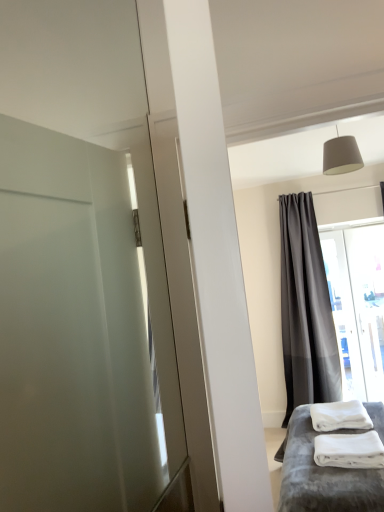
This screenshot has width=384, height=512. Describe the element at coordinates (340, 416) in the screenshot. I see `white fluffy bath towel at lower right` at that location.

Image resolution: width=384 pixels, height=512 pixels. What are the coordinates of `matte gray lampshade at upper center` in the screenshot? It's located at coord(341,155).

Describe the element at coordinates (341, 155) in the screenshot. The width and height of the screenshot is (384, 512). I see `matte gray lampshade at upper center` at that location.

Find the location of a particular element. dark gray sheer curtain at upper right is located at coordinates (306, 309).

The height and width of the screenshot is (512, 384). Describe the element at coordinates (358, 306) in the screenshot. I see `transparent glass window at right` at that location.

In order to click on white plush bed at lower right in this screenshot , I will do `click(323, 476)`.

From the image's perspective, between matte gray lampshade at upper center and white soft towels at lower right, which one is located above?

From the image's view, matte gray lampshade at upper center is above.

Is matte gray lampshade at upper center with white soft towels at lower right?

matte gray lampshade at upper center and white soft towels at lower right are clearly separated.

In terms of width, does matte gray lampshade at upper center look wider or thinner when compared to white soft towels at lower right?

Considering their sizes, matte gray lampshade at upper center looks slimmer than white soft towels at lower right.

Does point (354, 148) appear closer or farther from the camera than point (348, 445)?

Point (354, 148) appears to be farther away from the viewer than point (348, 445).

Locate an element on the screen. This screenshot has width=384, height=512. light fixture located above the transparent glass window at right (from the image's perspective) is located at coordinates (341, 155).

Is matte gray lampshade at upper center not inside transparent glass window at right?

Yes, matte gray lampshade at upper center is not within transparent glass window at right.

Is matte gray lampshade at upper center positioned far away from transparent glass window at right?

Indeed, matte gray lampshade at upper center is not near transparent glass window at right.

Does point (340, 166) come in front of point (340, 241)?

Yes, it is.

Could you tell me if white fluffy bath towel at lower right is turned towards white plush bed at lower right?

No, white fluffy bath towel at lower right does not turn towards white plush bed at lower right.

Is white fluffy bath towel at lower right taller or shorter than white plush bed at lower right?

white fluffy bath towel at lower right is shorter than white plush bed at lower right.

Does white fluffy bath towel at lower right have a lesser width compared to white plush bed at lower right?

Indeed, white fluffy bath towel at lower right has a lesser width compared to white plush bed at lower right.

Does white fluffy bath towel at lower right have a smaller size compared to white plush bed at lower right?

Correct, white fluffy bath towel at lower right occupies less space than white plush bed at lower right.

Which is more distant, [381,282] or [334,506]?

Point [381,282]

From a real-world perspective, who is located higher, transparent glass window at right or white plush bed at lower right?

transparent glass window at right, from a real-world perspective.

Is transparent glass window at right beside white plush bed at lower right?

transparent glass window at right and white plush bed at lower right are not in contact.

Can you tell me how much transparent glass window at right and white plush bed at lower right differ in facing direction?

87.9 degrees.

Which point is more distant from viewer, (345, 381) or (316, 438)?

Positioned behind is point (345, 381).

Is transparent glass window at right looking in the opposite direction of white soft towels at lower right?

No, transparent glass window at right is not facing the opposite direction of white soft towels at lower right.

Which is correct: transparent glass window at right is inside white soft towels at lower right, or outside of it?

transparent glass window at right cannot be found inside white soft towels at lower right.

Relative to white soft towels at lower right, is transparent glass window at right in front or behind?

Clearly, transparent glass window at right is behind white soft towels at lower right.

I want to click on material on the right side of white plush bed at lower right, so click(x=349, y=450).

Based on the photo, is white soft towels at lower right oriented towards white plush bed at lower right?

No.

How different are the orientations of white soft towels at lower right and white plush bed at lower right in degrees?

2.45 degrees.

Which object is closer to the camera taking this photo, white soft towels at lower right or white plush bed at lower right?

white plush bed at lower right.

Consider the image. How many degrees apart are the facing directions of white fluffy bath towel at lower right and matte gray lampshade at upper center?

They differ by 85.2 degrees in their facing directions.

Is white fluffy bath towel at lower right at the right side of matte gray lampshade at upper center?

Correct, you'll find white fluffy bath towel at lower right to the right of matte gray lampshade at upper center.

Does white fluffy bath towel at lower right have a larger size compared to matte gray lampshade at upper center?

No, white fluffy bath towel at lower right is not bigger than matte gray lampshade at upper center.

In the scene shown: Can you confirm if white fluffy bath towel at lower right is taller than matte gray lampshade at upper center?

No.

Where is `material to the left of matte gray lampshade at upper center`? The height and width of the screenshot is (512, 384). material to the left of matte gray lampshade at upper center is located at coordinates (349, 450).

At what (x,y) coordinates should I click in order to perform the action: click on light fixture above the transparent glass window at right (from a real-world perspective). Please return your answer as a coordinate pair (x, y). This screenshot has width=384, height=512. Looking at the image, I should click on (341, 155).

From the image, which object appears to be farther from white plush bed at lower right, transparent glass window at right or white soft towels at lower right?

transparent glass window at right.

Looking at the image, which one is located further to dark gray sheer curtain at upper right, white plush bed at lower right or white soft towels at lower right?

The object further to dark gray sheer curtain at upper right is white soft towels at lower right.

Estimate the real-world distances between objects in this image. Which object is closer to matte gray lampshade at upper center, white soft towels at lower right or white plush bed at lower right?

white soft towels at lower right is closer to matte gray lampshade at upper center.

Estimate the real-world distances between objects in this image. Which object is further from matte gray lampshade at upper center, white plush bed at lower right or white soft towels at lower right?

white plush bed at lower right.

Consider the image. When comparing their distances from matte gray lampshade at upper center, does white plush bed at lower right or dark gray sheer curtain at upper right seem closer?

dark gray sheer curtain at upper right lies closer to matte gray lampshade at upper center than the other object.

Based on their spatial positions, is white fluffy bath towel at lower right or white plush bed at lower right closer to white soft towels at lower right?

Based on the image, white plush bed at lower right appears to be nearer to white soft towels at lower right.

Which object lies nearer to the anchor point white fluffy bath towel at lower right, dark gray sheer curtain at upper right or white soft towels at lower right?

white soft towels at lower right.

Considering their positions, is transparent glass window at right positioned closer to dark gray sheer curtain at upper right than white fluffy bath towel at lower right?

The object closer to dark gray sheer curtain at upper right is transparent glass window at right.

The image size is (384, 512). Identify the location of light fixture between white plush bed at lower right and transparent glass window at right along the z-axis. (341, 155).

This screenshot has height=512, width=384. I want to click on light fixture between white soft towels at lower right and dark gray sheer curtain at upper right from front to back, so click(x=341, y=155).

You are a GUI agent. You are given a task and a screenshot of the screen. Output one action in this format:
    pyautogui.click(x=<x>, y=<y>)
    Task: Click on the curtain positioned between white plush bed at lower right and transparent glass window at right from near to far
    The width and height of the screenshot is (384, 512).
    Given the screenshot: What is the action you would take?
    pyautogui.click(x=306, y=309)

Where is `material between white plush bed at lower right and white fluffy bath towel at lower right in the front-back direction`? Image resolution: width=384 pixels, height=512 pixels. material between white plush bed at lower right and white fluffy bath towel at lower right in the front-back direction is located at coordinates (349, 450).